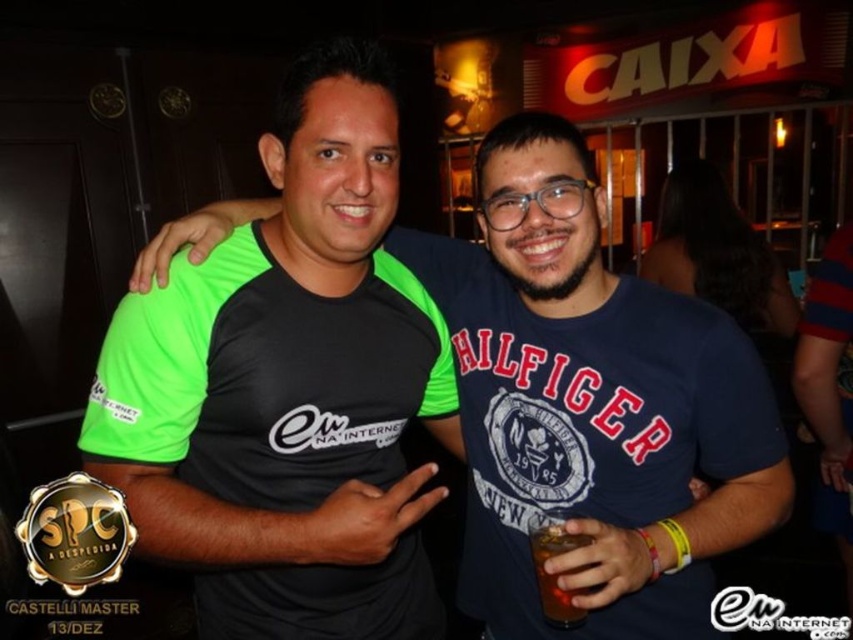
Is point (373, 461) positioned behind point (489, 570)?

No, (373, 461) is closer to viewer.

Is point (195, 320) less distant than point (569, 396)?

Yes, it is.

Does point (322, 208) come in front of point (508, 541)?

Yes, it is in front of point (508, 541).

Where is `neon green fabric shirt at center`? neon green fabric shirt at center is located at coordinates (288, 388).

Is black matte t-shirt at center to the left of brown liquid at center from the viewer's perspective?

Correct, you'll find black matte t-shirt at center to the left of brown liquid at center.

Does point (691, 330) come farther from viewer compared to point (532, 525)?

Yes, it is behind point (532, 525).

Find the location of a particular element. black matte t-shirt at center is located at coordinates (592, 406).

Is neon green fabric shirt at center thinner than brown liquid at center?

No.

Looking at this image, who is higher up, neon green fabric shirt at center or brown liquid at center?

neon green fabric shirt at center is above.

Between point (337, 403) and point (547, 602), which one is positioned in front?

Point (547, 602) is in front.

You are a GUI agent. You are given a task and a screenshot of the screen. Output one action in this format:
    pyautogui.click(x=<x>, y=<y>)
    Task: Click on the neon green fabric shirt at center
    The width and height of the screenshot is (853, 640).
    Given the screenshot: What is the action you would take?
    pyautogui.click(x=288, y=388)